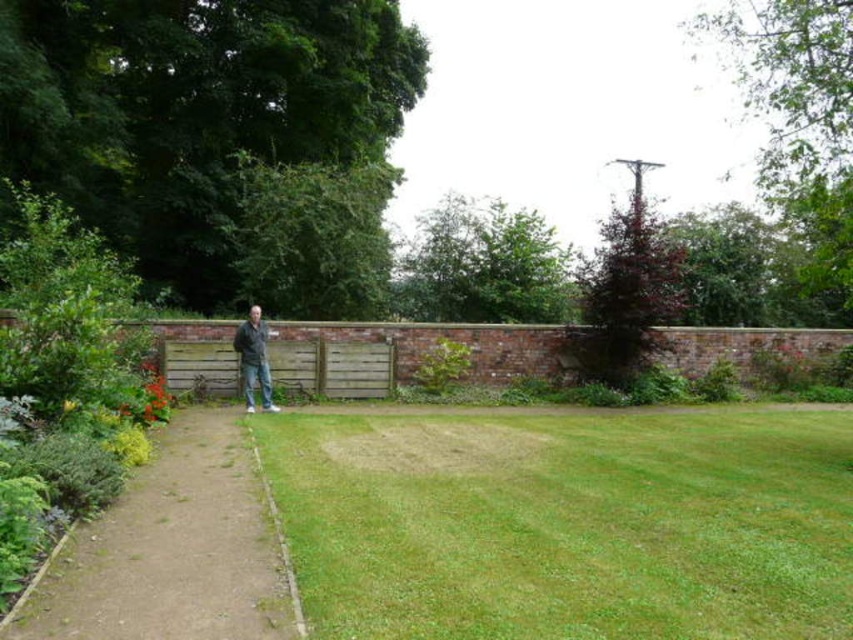
Can you confirm if dirt/gravel path at center-left is positioned below dark gray jacket at center?

Indeed, dirt/gravel path at center-left is positioned under dark gray jacket at center.

Between dirt/gravel path at center-left and dark gray jacket at center, which one has less height?

dirt/gravel path at center-left is shorter.

I want to click on dirt/gravel path at center-left, so click(x=172, y=548).

Does brick wall at center have a greater height compared to dark gray jacket at center?

No, brick wall at center is not taller than dark gray jacket at center.

Between point (695, 364) and point (258, 348), which one is positioned in front?

Positioned in front is point (258, 348).

The height and width of the screenshot is (640, 853). I want to click on brick wall at center, so click(428, 346).

Where is `brick wall at center`? This screenshot has height=640, width=853. brick wall at center is located at coordinates 428,346.

Is green grass at center below dirt/gravel path at center-left?

Actually, green grass at center is above dirt/gravel path at center-left.

How distant is green grass at center from dirt/gravel path at center-left?

green grass at center is 3.10 meters away from dirt/gravel path at center-left.

Find the location of a particular element. This screenshot has width=853, height=640. green grass at center is located at coordinates (x=567, y=524).